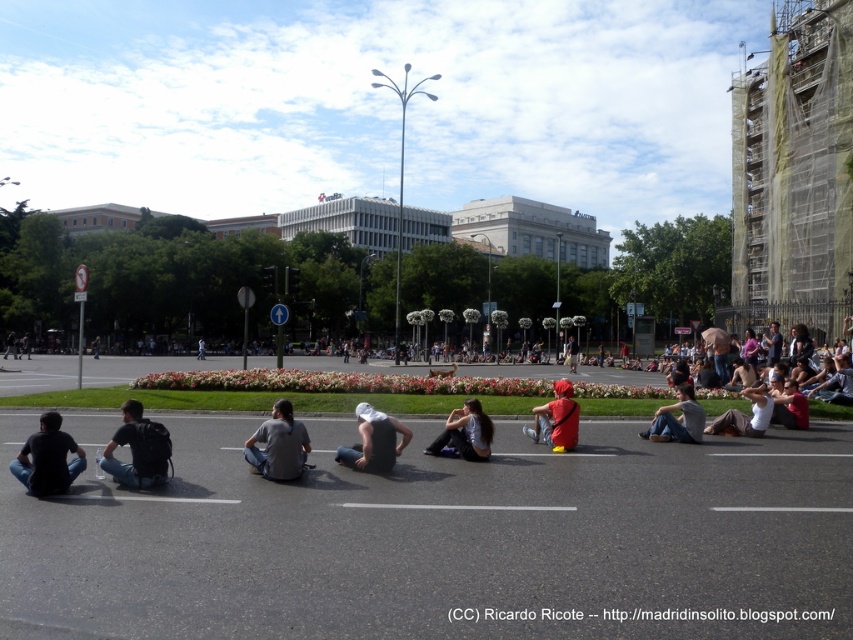
Question: Which point appears farthest from the camera in this image?

Choices:
 (A) (276, 472)
 (B) (347, 465)

Answer: (B)

Question: Estimate the real-world distances between objects in this image. Which object is closer to the dark gray t-shirt at lower left?

Choices:
 (A) red fabric bag at center
 (B) gray cotton shirt at lower right

Answer: (B)

Question: In this image, where is red fabric cap at center located relative to gray cotton shirt at lower right?

Choices:
 (A) below
 (B) above

Answer: (B)

Question: Which object appears closest to the camera in this image?

Choices:
 (A) dark gray fabric cap at center
 (B) matte black backpack at lower left
 (C) dark gray t-shirt at lower left
 (D) gray cotton shirt at lower right

Answer: (C)

Question: Does gray cotton shirt at center have a greater width compared to gray cotton shirt at lower right?

Choices:
 (A) yes
 (B) no

Answer: (A)

Question: Can you confirm if matte black backpack at lower left is thinner than dark gray t-shirt at lower left?

Choices:
 (A) yes
 (B) no

Answer: (B)